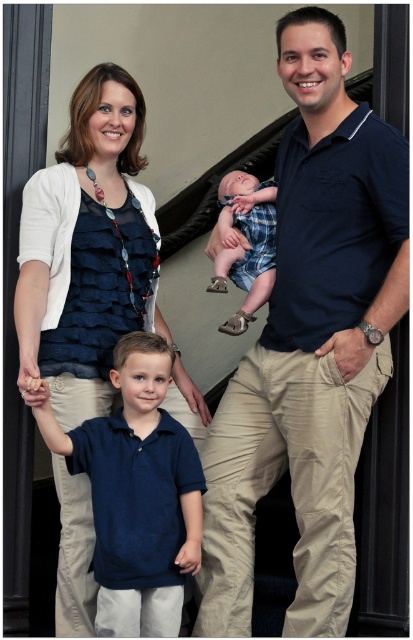
What is the color of the shirt worn by the young boy standing at the point with coordinates (310, 342)?

The dark blue polo shirt at center is located at point (310, 342), so the color is dark blue.